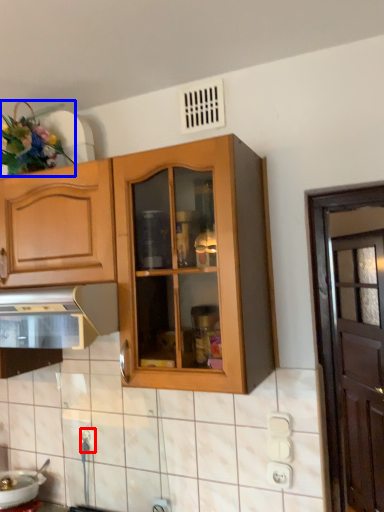
Question: Which object appears closest to the camera in this image, electric outlet (highlighted by a red box) or flower (highlighted by a blue box)?

Choices:
 (A) electric outlet
 (B) flower

Answer: (B)